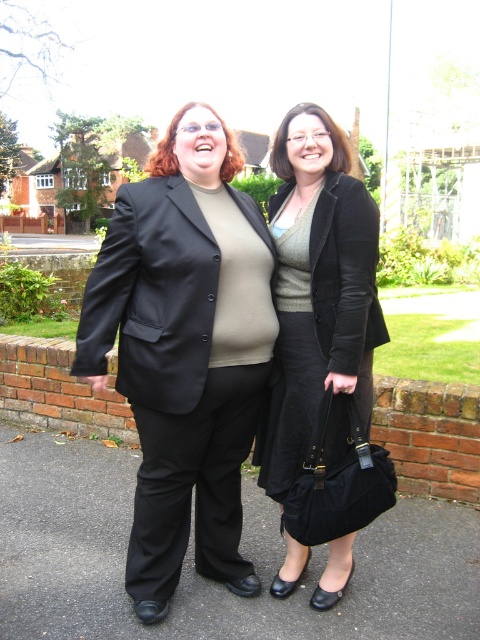
You are a fashion designer observing two outfits in the image. The first outfit has a black smooth blazer at center and the second has a matte black skirt at center. Which clothing item is wider?

The black smooth blazer at center is wider than the matte black skirt at center as its width surpasses the skirt.

What are the coordinates of the black smooth blazer at center?

The black smooth blazer at center is located at coordinates point [171,381].

You are a fashion designer observing two items in the image. The black smooth blazer at center and the matte black skirt at center. Which item is shorter in height?

The black smooth blazer at center is not as tall as the matte black skirt at center, so the black smooth blazer at center is shorter in height.